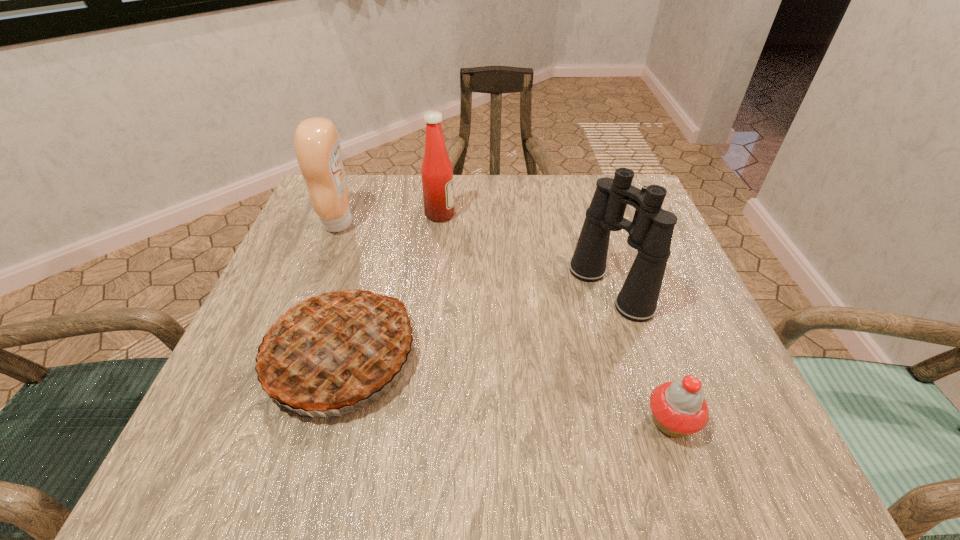
Locate an element on the screen. The image size is (960, 540). the right condiment is located at coordinates (436, 171).

I want to click on the left condiment, so click(316, 141).

This screenshot has height=540, width=960. Identify the location of binoculars. (650, 232).

Identify the location of the second shortest object. (333, 349).

Image resolution: width=960 pixels, height=540 pixels. I want to click on cupcake, so click(x=678, y=407).

You are a GUI agent. You are given a task and a screenshot of the screen. Output one action in this format:
    pyautogui.click(x=<x>, y=<y>)
    Task: Click on the free space located on the front-facing side of the right condiment
    This screenshot has height=540, width=960.
    Given the screenshot: What is the action you would take?
    pyautogui.click(x=587, y=215)

Locate an element on the screen. vacant position located on the label of the left condiment is located at coordinates (433, 223).

Where is `free space located 0.300m on the left of the binoculars`? This screenshot has height=540, width=960. free space located 0.300m on the left of the binoculars is located at coordinates (419, 288).

Where is `blank area located 0.320m on the right of the second shortest object`? The image size is (960, 540). blank area located 0.320m on the right of the second shortest object is located at coordinates (606, 357).

Identify the location of vacant space located on the left of the cupcake. The image size is (960, 540). (401, 422).